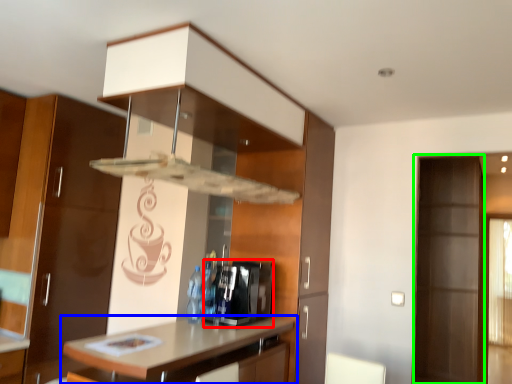
Question: Based on their relative distances, which object is farther from appliance (highlighted by a red box)? Choose from countertop (highlighted by a blue box) and screen door (highlighted by a green box).

Choices:
 (A) countertop
 (B) screen door

Answer: (B)